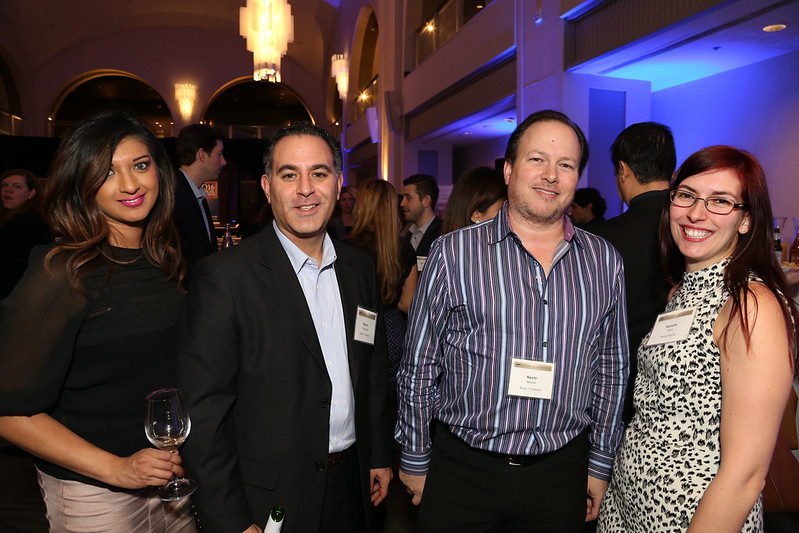
At what (x,y) coordinates should I click in order to perform the action: click on glass. Please return your answer as a coordinate pair (x, y). The width and height of the screenshot is (799, 533). Looking at the image, I should click on (168, 423).